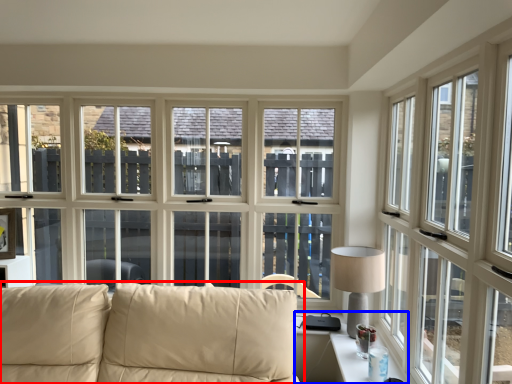
Question: Which point is closer to the camera, studio couch (highlighted by a red box) or table (highlighted by a blue box)?

Choices:
 (A) studio couch
 (B) table

Answer: (A)